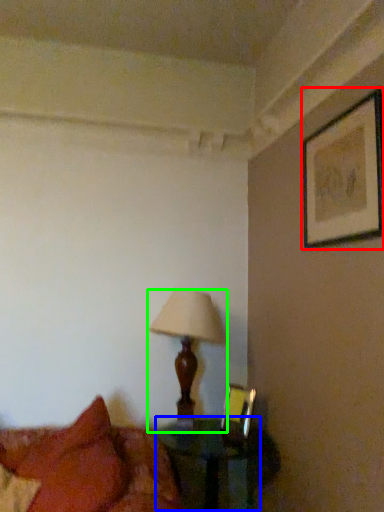
Question: Considering the real-world distances, which object is closest to picture frame (highlighted by a red box)? table (highlighted by a blue box) or lamp (highlighted by a green box).

Choices:
 (A) table
 (B) lamp

Answer: (B)